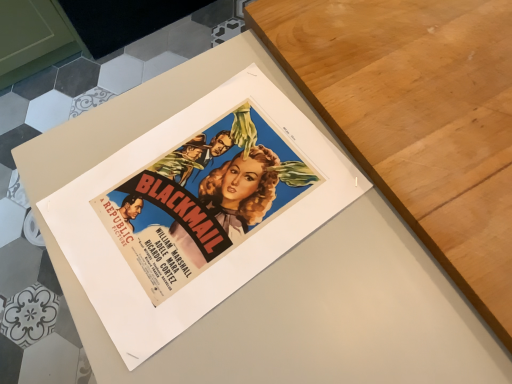
Find the location of a particular element. This screenshot has width=512, height=384. wooden table at upper right is located at coordinates (418, 118).

What do you see at coordinates (418, 118) in the screenshot? The height and width of the screenshot is (384, 512). I see `wooden table at upper right` at bounding box center [418, 118].

At what (x,y) coordinates should I click in order to perform the action: click on matte paper poster at center. Please return your answer as a coordinate pair (x, y). This screenshot has width=512, height=384. Looking at the image, I should click on (196, 211).

Describe the element at coordinates (196, 211) in the screenshot. Image resolution: width=512 pixels, height=384 pixels. I see `matte paper poster at center` at that location.

Where is `wooden table at upper right`? Image resolution: width=512 pixels, height=384 pixels. wooden table at upper right is located at coordinates (418, 118).

Is matte paper poster at center to the left of wooden table at upper right from the viewer's perspective?

No.

Is the position of matte paper poster at center less distant than that of wooden table at upper right?

Yes, it is in front of wooden table at upper right.

Considering the positions of points (228, 231) and (429, 23), is point (228, 231) farther from camera compared to point (429, 23)?

No.

From the image's perspective, would you say matte paper poster at center is positioned over wooden table at upper right?

Actually, matte paper poster at center appears below wooden table at upper right in the image.

From a real-world perspective, is matte paper poster at center positioned under wooden table at upper right based on gravity?

Yes.

Looking at their sizes, would you say matte paper poster at center is wider or thinner than wooden table at upper right?

Considering their sizes, matte paper poster at center looks broader than wooden table at upper right.

Considering the relative sizes of matte paper poster at center and wooden table at upper right in the image provided, is matte paper poster at center taller than wooden table at upper right?

Correct, matte paper poster at center is much taller as wooden table at upper right.

Which of these two, matte paper poster at center or wooden table at upper right, is smaller?

Smaller between the two is wooden table at upper right.

Is matte paper poster at center located outside wooden table at upper right?

Yes, matte paper poster at center is not within wooden table at upper right.

Are matte paper poster at center and wooden table at upper right located far from each other?

No.

Could you tell me if matte paper poster at center is facing wooden table at upper right?

No, matte paper poster at center is not facing towards wooden table at upper right.

What's the angular difference between matte paper poster at center and wooden table at upper right's facing directions?

The angle between the facing direction of matte paper poster at center and the facing direction of wooden table at upper right is 90.9 degrees.

Identify the location of poster that is on the right side of wooden table at upper right. The width and height of the screenshot is (512, 384). click(x=196, y=211).

Is wooden table at upper right at the left side of matte paper poster at center?

Correct, you'll find wooden table at upper right to the left of matte paper poster at center.

From the picture: Which object is further away from the camera taking this photo, wooden table at upper right or matte paper poster at center?

wooden table at upper right is more distant.

Considering the positions of point (410, 141) and point (278, 198), is point (410, 141) closer or farther from the camera than point (278, 198)?

Clearly, point (410, 141) is closer to the camera than point (278, 198).

From the image's perspective, is wooden table at upper right located above matte paper poster at center?

Correct, wooden table at upper right appears higher than matte paper poster at center in the image.

From a real-world perspective, which is physically below, wooden table at upper right or matte paper poster at center?

From a 3D spatial view, matte paper poster at center is below.

Looking at their sizes, would you say wooden table at upper right is wider or thinner than matte paper poster at center?

Clearly, wooden table at upper right has less width compared to matte paper poster at center.

Can you confirm if wooden table at upper right is shorter than matte paper poster at center?

Indeed, wooden table at upper right has a lesser height compared to matte paper poster at center.

Is wooden table at upper right bigger or smaller than matte paper poster at center?

Clearly, wooden table at upper right is smaller in size than matte paper poster at center.

Is wooden table at upper right not inside matte paper poster at center?

No, wooden table at upper right is inside or overlapping with matte paper poster at center.

Are wooden table at upper right and matte paper poster at center located far from each other?

wooden table at upper right is near matte paper poster at center, not far away.

Is wooden table at upper right looking in the opposite direction of matte paper poster at center?

Absolutely, wooden table at upper right is directed away from matte paper poster at center.

What are the coordinates of `poster below the wooden table at upper right (from the image's perspective)` in the screenshot? It's located at (196, 211).

Where is `table behind the matte paper poster at center`? table behind the matte paper poster at center is located at coordinates (418, 118).

The image size is (512, 384). Identify the location of table above the matte paper poster at center (from a real-world perspective). (418, 118).